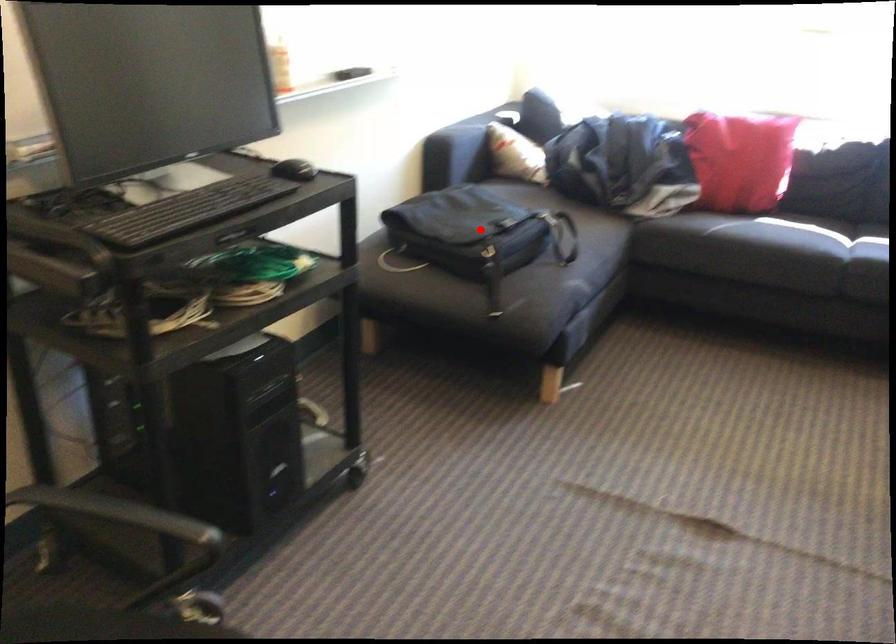
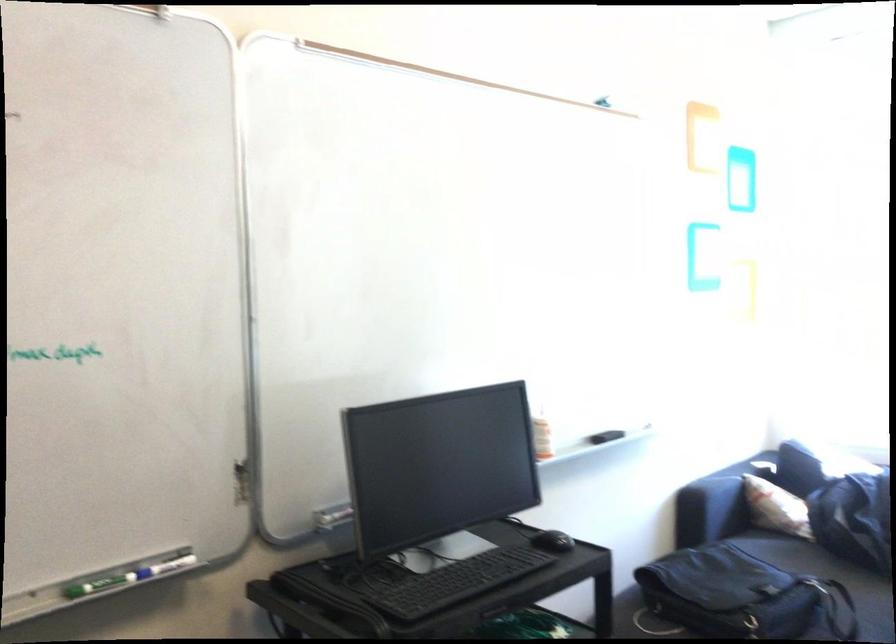
Find the pixel in the second image that matches the highlighted location in the first image.

(744, 596)